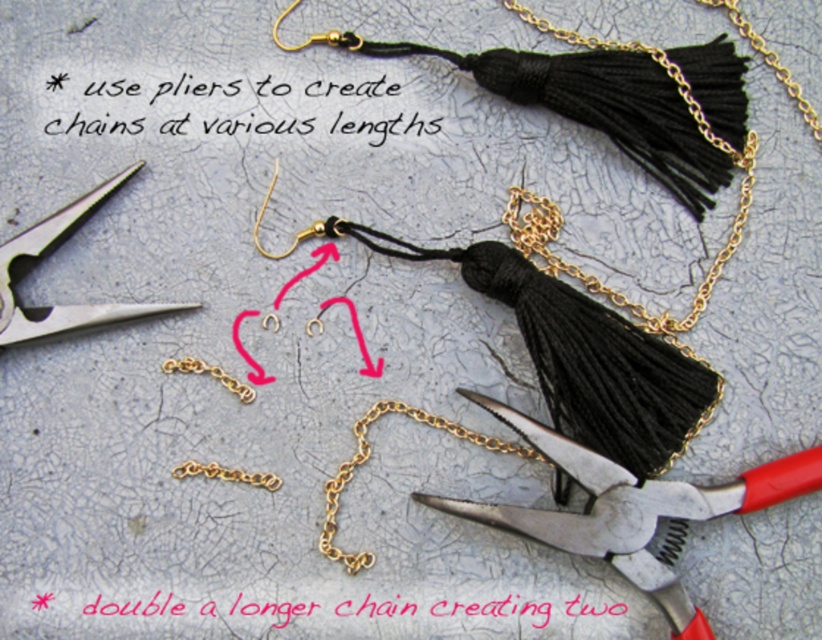
Question: Among these points, which one is nearest to the camera?

Choices:
 (A) (714, 502)
 (B) (354, 564)

Answer: (A)

Question: Is metallic pliers at lower right in front of pink paper at center?

Choices:
 (A) yes
 (B) no

Answer: (A)

Question: Among these objects, which one is nearest to the camera?

Choices:
 (A) silver metallic scissors at upper left
 (B) pink paper at center
 (C) gold chain at center

Answer: (B)

Question: Does metallic pliers at lower right have a larger size compared to black paper at upper center?

Choices:
 (A) yes
 (B) no

Answer: (A)

Question: Where is pink paper at center located in relation to gold chain at center in the image?

Choices:
 (A) left
 (B) right

Answer: (A)

Question: Which object is the farthest from the black paper at upper center?

Choices:
 (A) metallic pliers at lower right
 (B) pink paper at center
 (C) gold chain at center

Answer: (B)